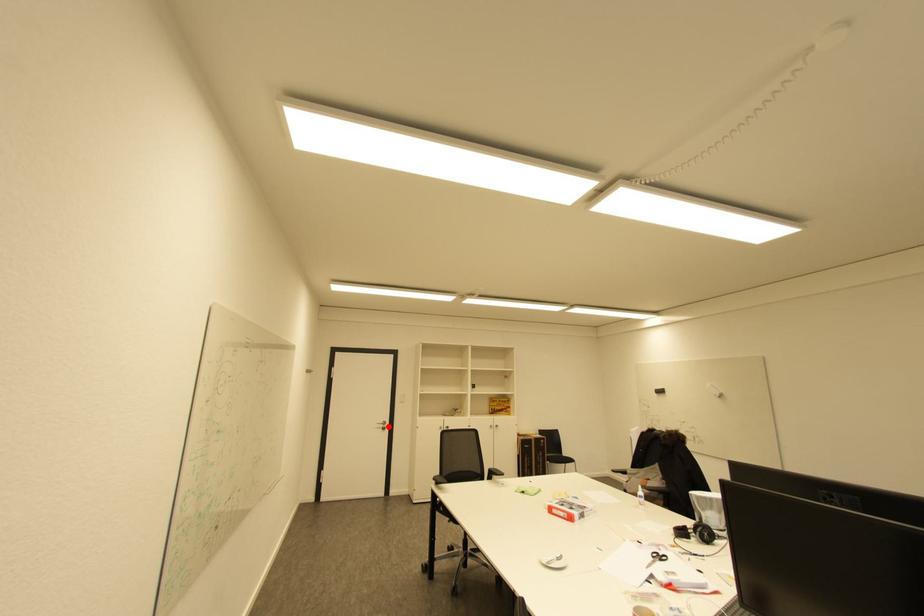
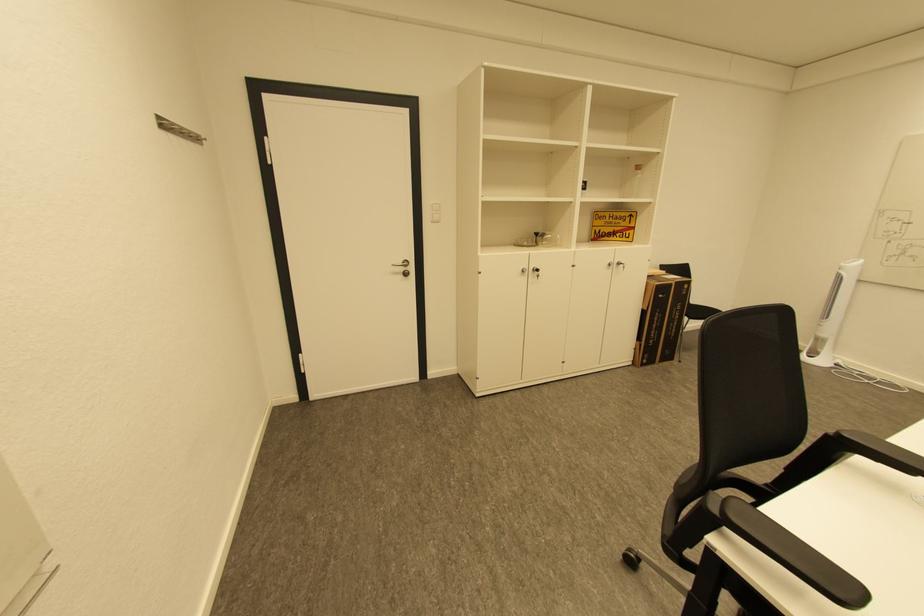
Question: A red point is marked in image1. In image2, is the corresponding 3D point closer to the camera or farther? Reply with the corresponding letter.

Choices:
 (A) The corresponding 3D point is closer.
 (B) The corresponding 3D point is farther.

Answer: (A)